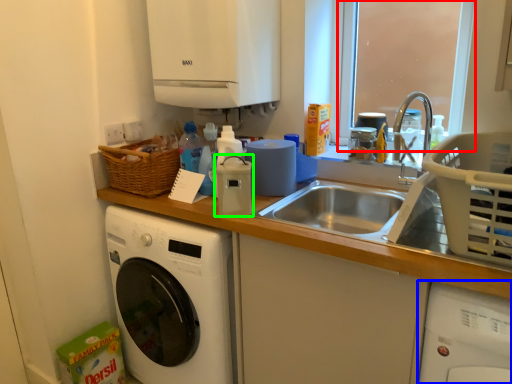
Question: Which is nearer to the window screen (highlighted by a red box)? washing machine (highlighted by a blue box) or appliance (highlighted by a green box).

Choices:
 (A) washing machine
 (B) appliance

Answer: (A)